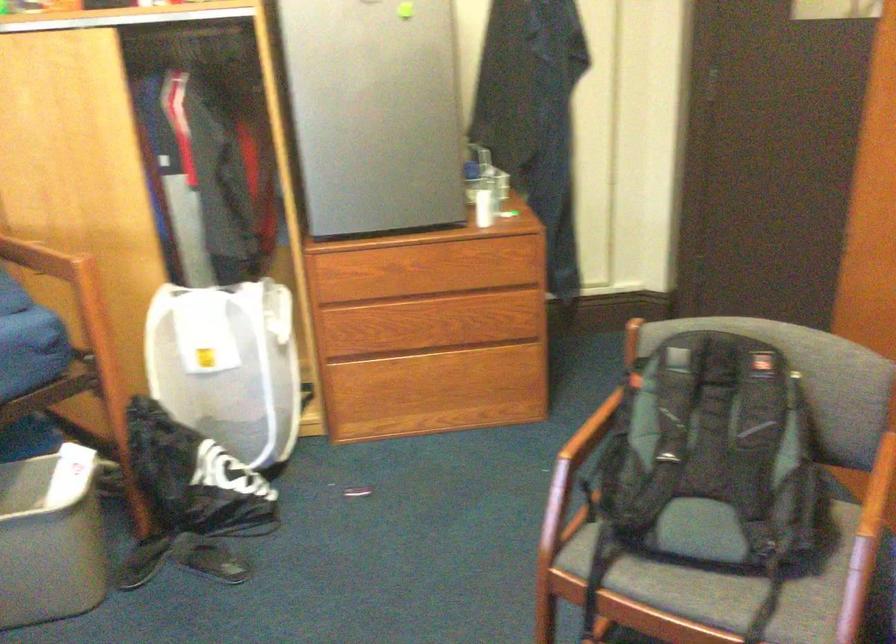
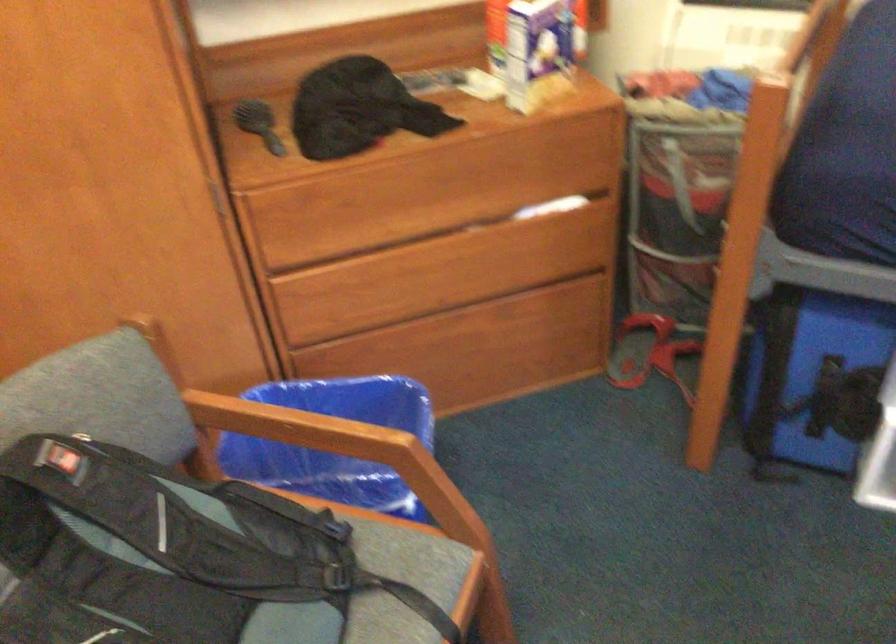
The point at (754, 451) is marked in the first image. Where is the corresponding point in the second image?

(162, 543)